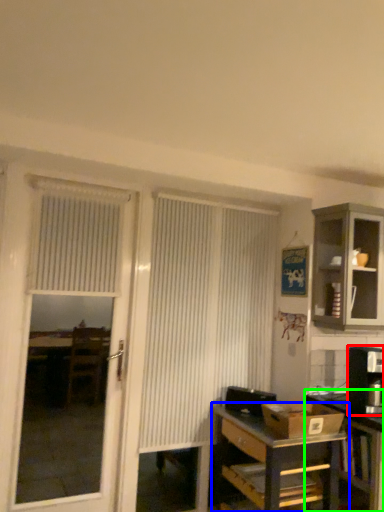
Question: Considering the real-world distances, which object is farthest from appliance (highlighted by a red box)? desk (highlighted by a blue box) or table (highlighted by a green box)?

Choices:
 (A) desk
 (B) table

Answer: (A)